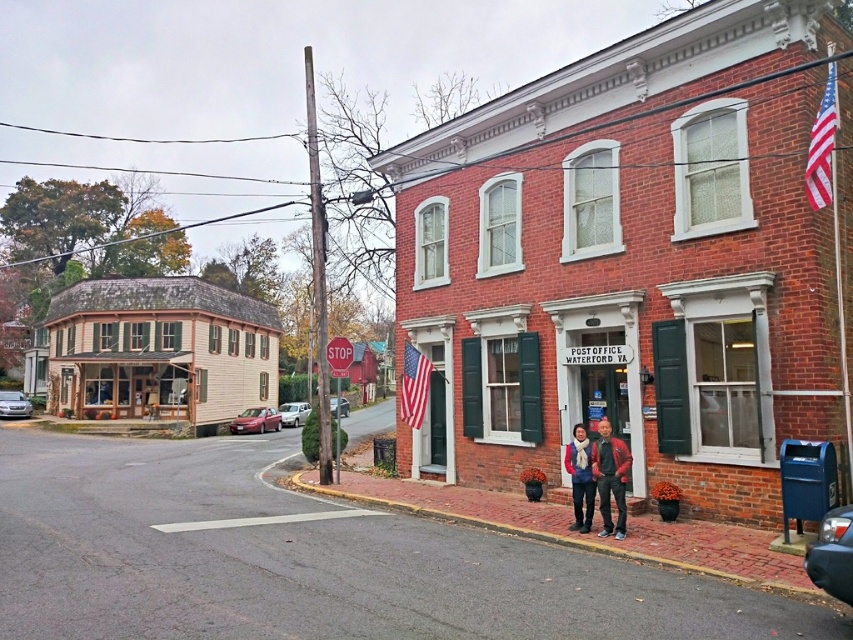
Is matte blue scarf at center below american flag at center?

Yes.

Is matte blue scarf at center above american flag at center?

Actually, matte blue scarf at center is below american flag at center.

Is point (579, 531) positioned after point (405, 406)?

No.

This screenshot has width=853, height=640. Identify the location of matte blue scarf at center. (579, 477).

Between point (822, 118) and point (576, 493), which one is positioned in front?

Point (822, 118)

Between red fabric flag at upper right and matte blue scarf at center, which one has less height?

Result: matte blue scarf at center is shorter.

Describe the element at coordinates (822, 147) in the screenshot. The image size is (853, 640). I see `red fabric flag at upper right` at that location.

Identify the location of red fabric flag at upper right. The width and height of the screenshot is (853, 640). (822, 147).

Which of these two, red fabric flag at upper right or red metal stop sign at center, stands taller?

red fabric flag at upper right

Who is more distant from viewer, (808, 195) or (341, 372)?

The point (341, 372) is behind.

Does point (811, 124) lie behind point (326, 358)?

No, (811, 124) is closer to viewer.

You are a GUI agent. You are given a task and a screenshot of the screen. Output one action in this format:
    pyautogui.click(x=<x>, y=<y>)
    Task: Click on the red fabric flag at upper right
    This screenshot has width=853, height=640.
    Given the screenshot: What is the action you would take?
    pyautogui.click(x=822, y=147)